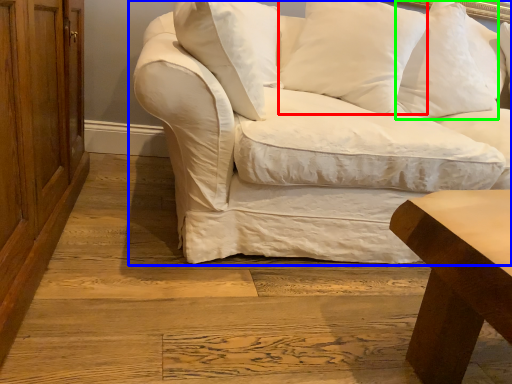
Question: Based on their relative distances, which object is nearer to pillow (highlighted by a red box)? Choose from studio couch (highlighted by a blue box) and pillow (highlighted by a green box).

Choices:
 (A) studio couch
 (B) pillow

Answer: (A)